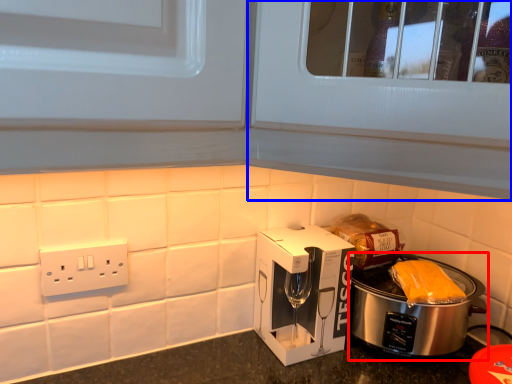
Question: Which object appears closest to the camera in this image, slow cooker (highlighted by a red box) or glass door (highlighted by a blue box)?

Choices:
 (A) slow cooker
 (B) glass door

Answer: (B)